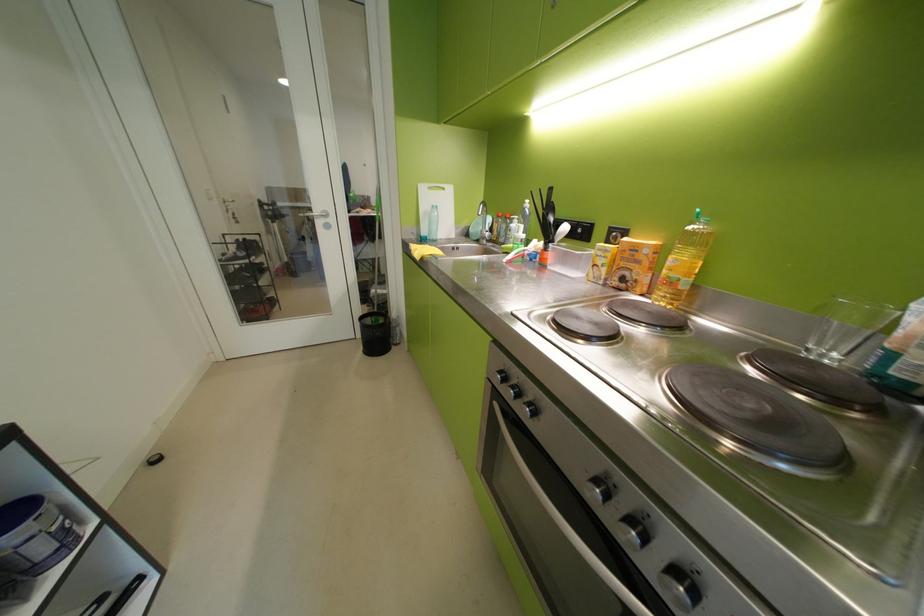
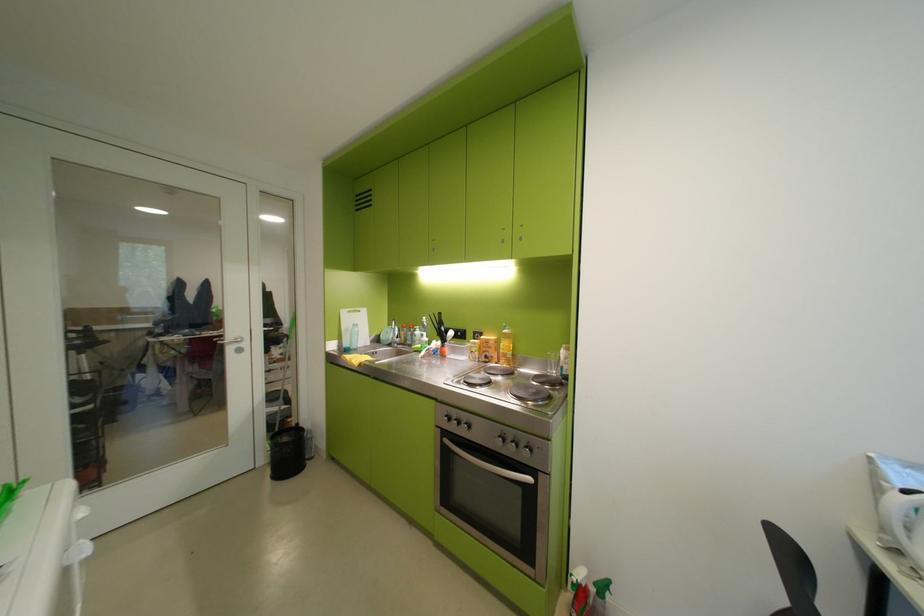
The point at (516, 379) is marked in the first image. Where is the corresponding point in the second image?

(459, 419)